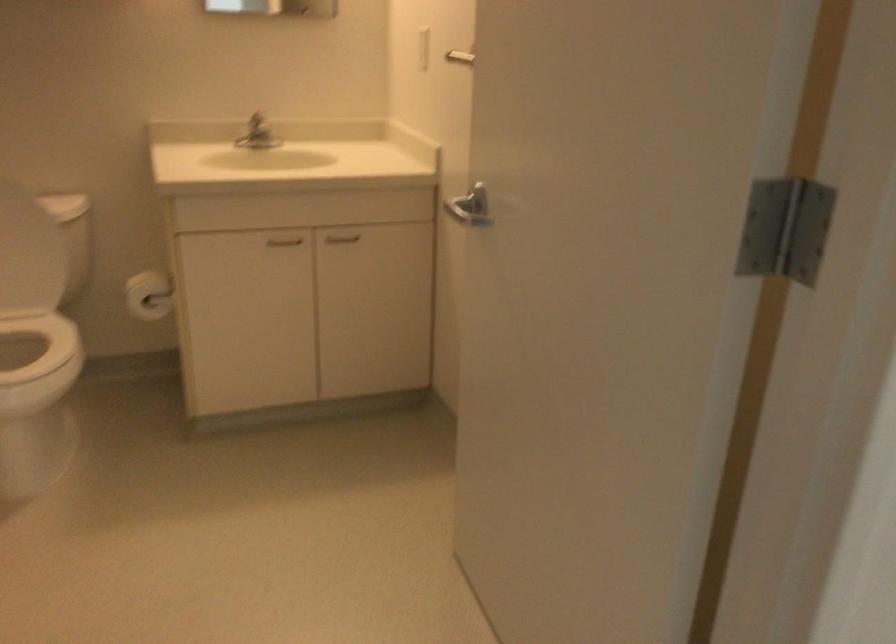
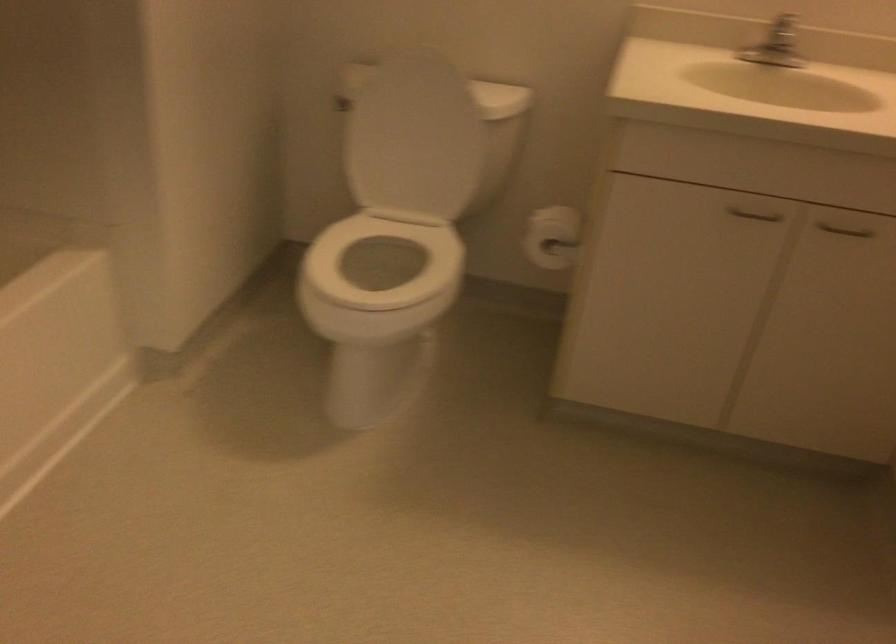
In the second image, find the point that corresponds to pixel 266 133 in the first image.

(778, 55)